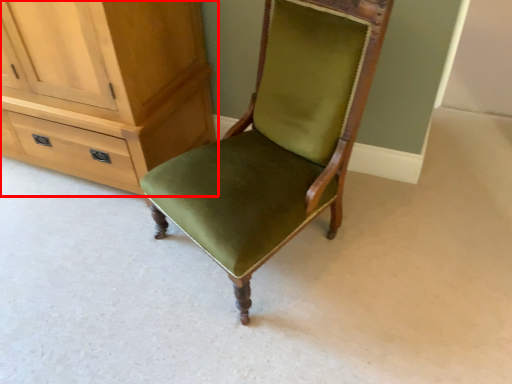
Question: From the image, what is the correct spatial relationship of cabinetry (annotated by the red box) in relation to chair?

Choices:
 (A) right
 (B) left

Answer: (B)